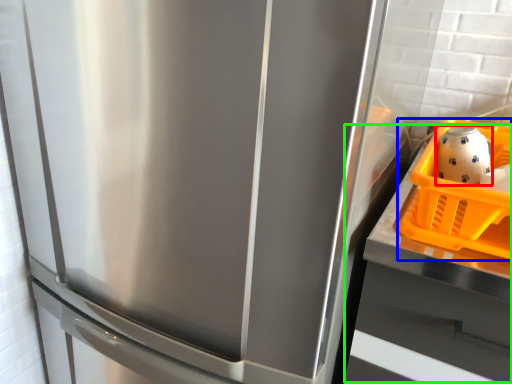
Question: Which is farther away from tea pot (highlighted by a red box)? basket (highlighted by a blue box) or counter top (highlighted by a green box)?

Choices:
 (A) basket
 (B) counter top

Answer: (B)